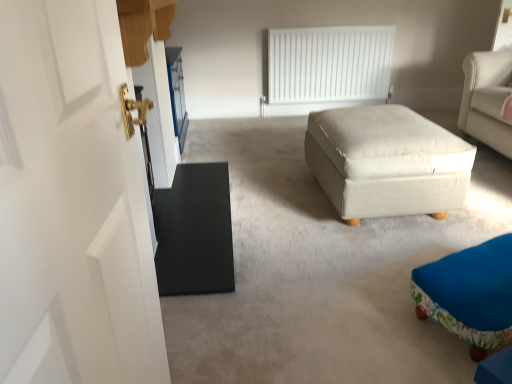
You are a GUI agent. You are given a task and a screenshot of the screen. Output one action in this format:
    pyautogui.click(x=<x>, y=<y>)
    Task: Click on the vacant space that is to the left of floral fabric ottoman at lower right
    
    Given the screenshot: What is the action you would take?
    pyautogui.click(x=368, y=305)